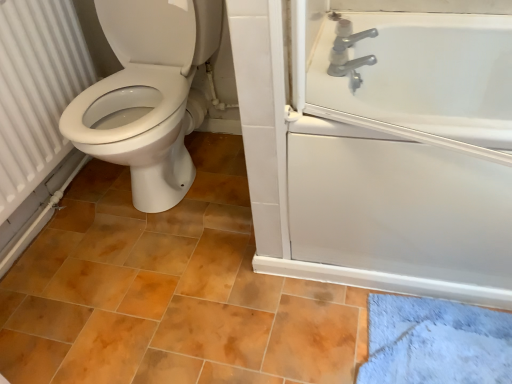
Question: Can you confirm if white glossy bathtub at upper right is shorter than silver metallic faucet at upper right?

Choices:
 (A) yes
 (B) no

Answer: (B)

Question: From the image's perspective, is white glossy bathtub at upper right above silver metallic faucet at upper right?

Choices:
 (A) no
 (B) yes

Answer: (A)

Question: Can silver metallic faucet at upper right be found inside white glossy bathtub at upper right?

Choices:
 (A) no
 (B) yes

Answer: (A)

Question: Is white glossy bathtub at upper right positioned with its back to silver metallic faucet at upper right?

Choices:
 (A) no
 (B) yes

Answer: (A)

Question: Is white glossy bathtub at upper right facing towards silver metallic faucet at upper right?

Choices:
 (A) yes
 (B) no

Answer: (B)

Question: Looking at the image, does white glossy bathtub at upper right seem bigger or smaller compared to white textured radiator at left?

Choices:
 (A) small
 (B) big

Answer: (B)

Question: Is point pos(330,180) positioned closer to the camera than point pos(54,51)?

Choices:
 (A) closer
 (B) farther

Answer: (A)

Question: From a real-world perspective, is white glossy bathtub at upper right physically located above or below white textured radiator at left?

Choices:
 (A) below
 (B) above

Answer: (A)

Question: Considering the positions of white glossy bathtub at upper right and white textured radiator at left in the image, is white glossy bathtub at upper right taller or shorter than white textured radiator at left?

Choices:
 (A) tall
 (B) short

Answer: (B)

Question: Would you say white textured radiator at left is inside or outside silver metallic faucet at upper right?

Choices:
 (A) outside
 (B) inside

Answer: (A)

Question: In terms of size, does white textured radiator at left appear bigger or smaller than silver metallic faucet at upper right?

Choices:
 (A) small
 (B) big

Answer: (B)

Question: Is white textured radiator at left taller or shorter than silver metallic faucet at upper right?

Choices:
 (A) tall
 (B) short

Answer: (A)

Question: From the image's perspective, is white textured radiator at left positioned above or below silver metallic faucet at upper right?

Choices:
 (A) below
 (B) above

Answer: (A)

Question: In terms of size, does white glossy bathtub at upper right appear bigger or smaller than silver metallic faucet at upper right?

Choices:
 (A) big
 (B) small

Answer: (A)

Question: From the image's perspective, is white glossy bathtub at upper right above or below silver metallic faucet at upper right?

Choices:
 (A) below
 (B) above

Answer: (A)